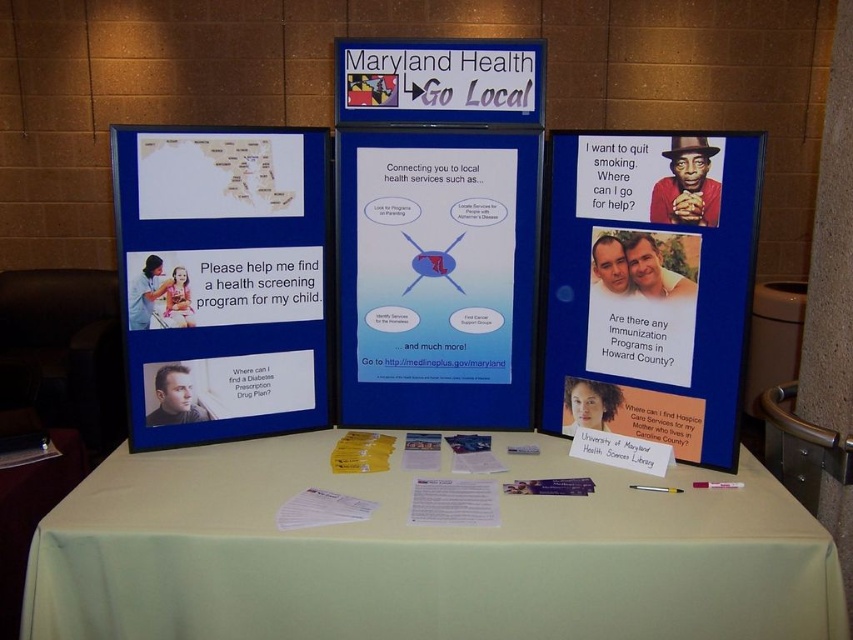
Question: Which point is closer to the camera?

Choices:
 (A) green fabric tablecloth at center
 (B) matte blue poster at center
 (C) matte paper poster at right

Answer: (A)

Question: Can you confirm if blue matte poster at left is positioned above matte paper poster at right?

Choices:
 (A) yes
 (B) no

Answer: (A)

Question: Which object is positioned closest to the green fabric tablecloth at center?

Choices:
 (A) matte blue poster at center
 (B) blue matte poster at left
 (C) matte paper poster at right

Answer: (B)

Question: Is green fabric tablecloth at center bigger than matte paper poster at right?

Choices:
 (A) no
 (B) yes

Answer: (B)

Question: Is the position of matte paper poster at right less distant than that of matte blue poster at center?

Choices:
 (A) yes
 (B) no

Answer: (A)

Question: Among these objects, which one is nearest to the camera?

Choices:
 (A) matte paper poster at right
 (B) matte blue poster at center
 (C) green fabric tablecloth at center
 (D) blue matte poster at left

Answer: (C)